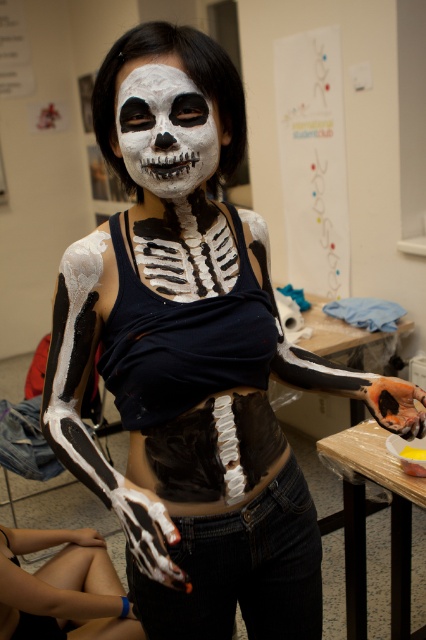
Does point (2, 538) come in front of point (132, 124)?

That is False.

Can you confirm if white matte skeleton hand at lower left is bigger than white matte skull at center?

Correct, white matte skeleton hand at lower left is larger in size than white matte skull at center.

Which is in front, point (92, 618) or point (210, 108)?

Point (210, 108)

Find the location of a particular element. white matte skeleton hand at lower left is located at coordinates (62, 588).